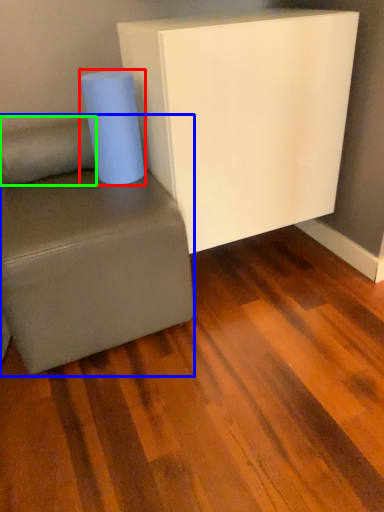
Question: Which is farther away from paper towel (highlighted by a red box)? studio couch (highlighted by a blue box) or pillow (highlighted by a green box)?

Choices:
 (A) studio couch
 (B) pillow

Answer: (A)